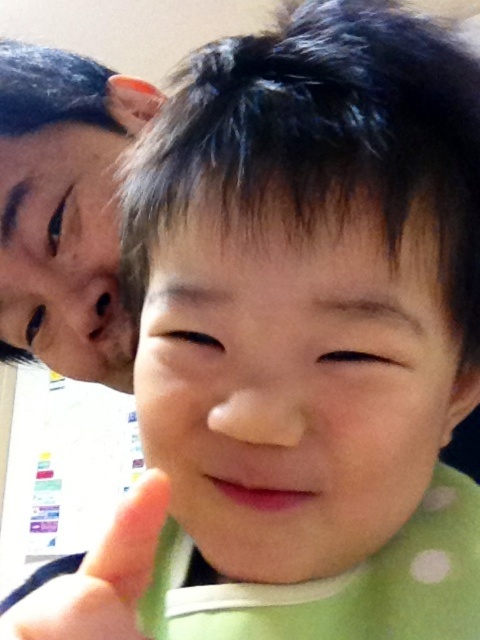
You are a photographer who just took a picture of a child pointing at the camera. You want to check if there is any black hair visible at the point you specified in the image. Is there any black hair at point (66, 211)?

Yes, at point (66, 211) there is matte black hair at upper left.

Based on the scene description, can you determine if the matte black hair at upper left is wider than the pink matte mouth at center?

The matte black hair at upper left might be wider than pink matte mouth at center according to the description.